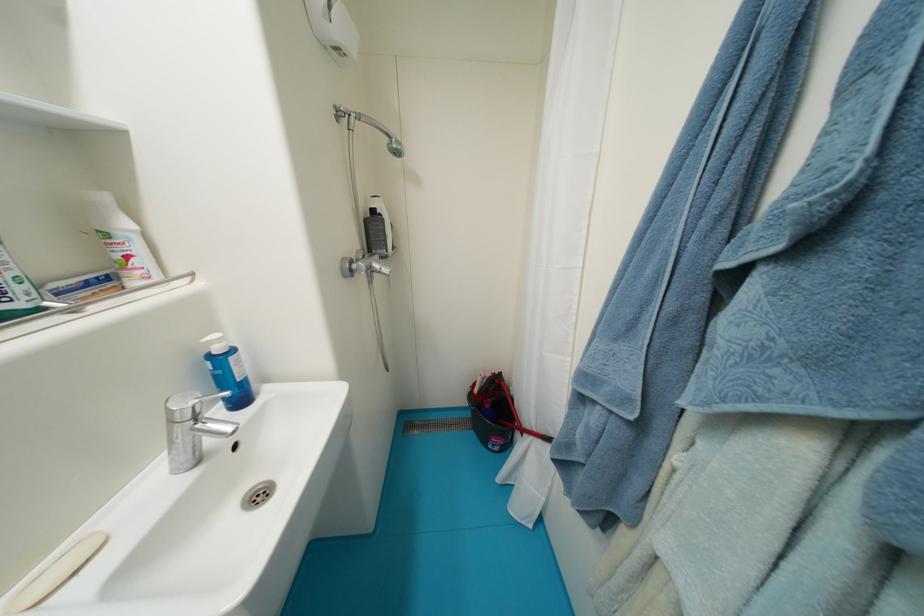
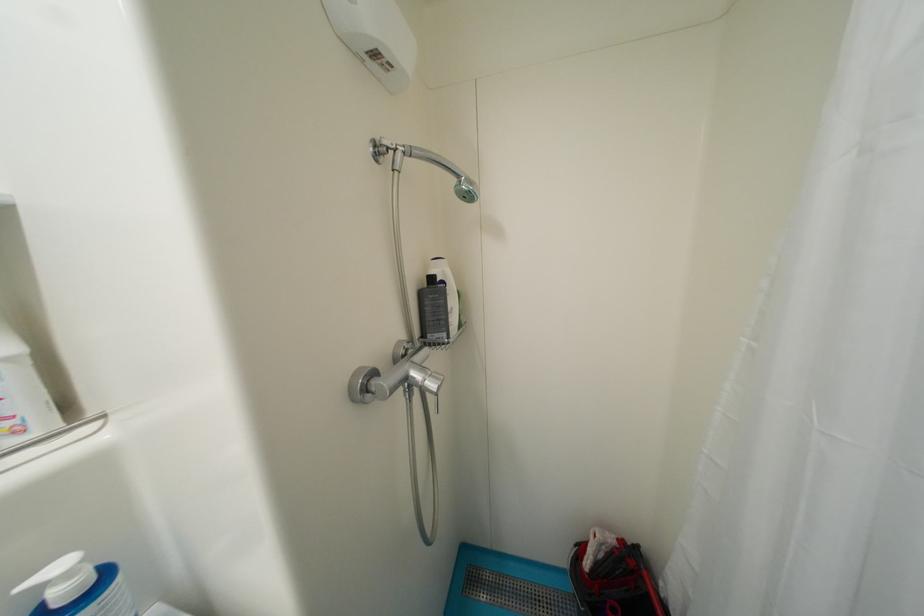
The point at (357,267) is marked in the first image. Where is the corresponding point in the second image?

(374, 383)